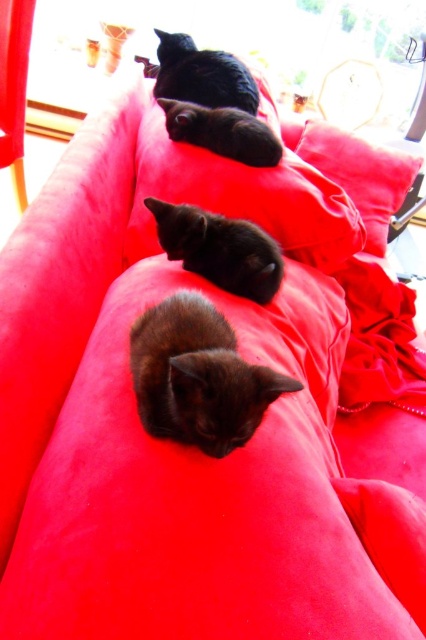
Who is taller, black velvet cat at center or shiny black cat at upper center?

With more height is shiny black cat at upper center.

Identify the location of black velvet cat at center. The height and width of the screenshot is (640, 426). (219, 248).

Where is `black velvet cat at center`? This screenshot has width=426, height=640. black velvet cat at center is located at coordinates (219, 248).

Where is `black velvet cat at center`? Image resolution: width=426 pixels, height=640 pixels. black velvet cat at center is located at coordinates (219, 248).

Which is more to the right, black velvet cat at center or velvet cushion at center?

velvet cushion at center is more to the right.

Which is in front, point (270, 250) or point (400, 157)?

Positioned in front is point (270, 250).

Between point (235, 253) and point (368, 234), which one is positioned in front?

Point (235, 253) is in front.

You are a GUI agent. You are given a task and a screenshot of the screen. Output one action in this format:
    pyautogui.click(x=<x>, y=<y>)
    Task: Click on the black velvet cat at center
    Image resolution: width=426 pixels, height=640 pixels.
    Given the screenshot: What is the action you would take?
    pyautogui.click(x=219, y=248)

Does velvet cushion at center appear on the right side of shiny black cat at center?

Yes, velvet cushion at center is to the right of shiny black cat at center.

Locate an element on the screen. The width and height of the screenshot is (426, 640). velvet cushion at center is located at coordinates (362, 176).

Where is `velvet cushion at center`? This screenshot has width=426, height=640. velvet cushion at center is located at coordinates (362, 176).